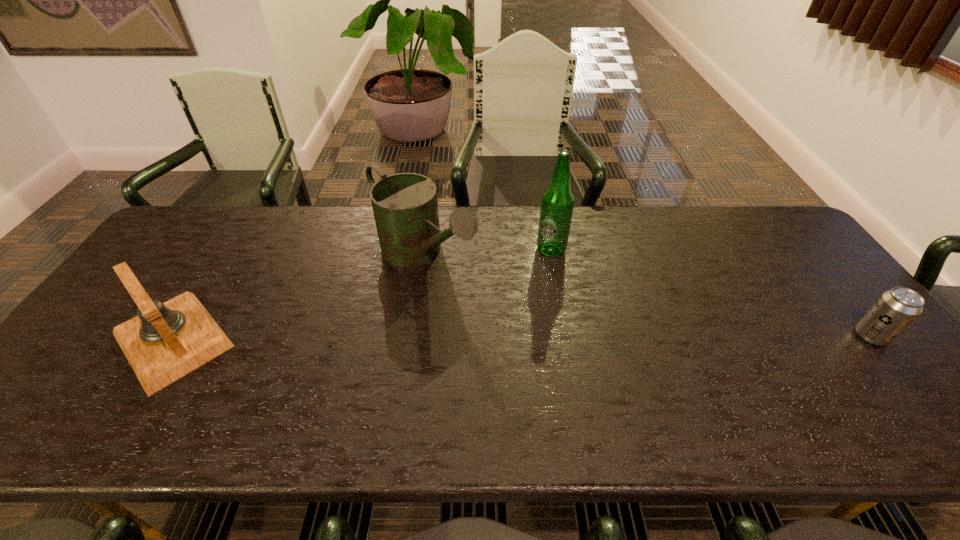
Where is `free location located 0.380m on the label of the beer bottle`? The width and height of the screenshot is (960, 540). free location located 0.380m on the label of the beer bottle is located at coordinates (579, 366).

At what (x,y) coordinates should I click in order to perform the action: click on free space located on the label of the beer bottle. Please return your answer as a coordinate pair (x, y). This screenshot has height=540, width=960. Looking at the image, I should click on (565, 313).

What are the coordinates of `free location located on the label of the beer bottle` in the screenshot? It's located at coord(569,327).

Locate an element on the screen. The height and width of the screenshot is (540, 960). free region located with the spout on the watering can is located at coordinates (566, 368).

This screenshot has width=960, height=540. Find the location of `vacant area located 0.390m with the spout on the watering can`. vacant area located 0.390m with the spout on the watering can is located at coordinates (570, 371).

This screenshot has width=960, height=540. Identify the location of vacant space located 0.380m with the spout on the watering can. (566, 368).

Where is `beer bottle present at the far edge`? beer bottle present at the far edge is located at coordinates (557, 202).

Image resolution: width=960 pixels, height=540 pixels. I want to click on watering can situated at the far edge, so click(x=405, y=206).

Locate an element on the screen. object located in the near edge section of the desktop is located at coordinates (166, 341).

The image size is (960, 540). I want to click on object present at the left edge, so click(x=166, y=341).